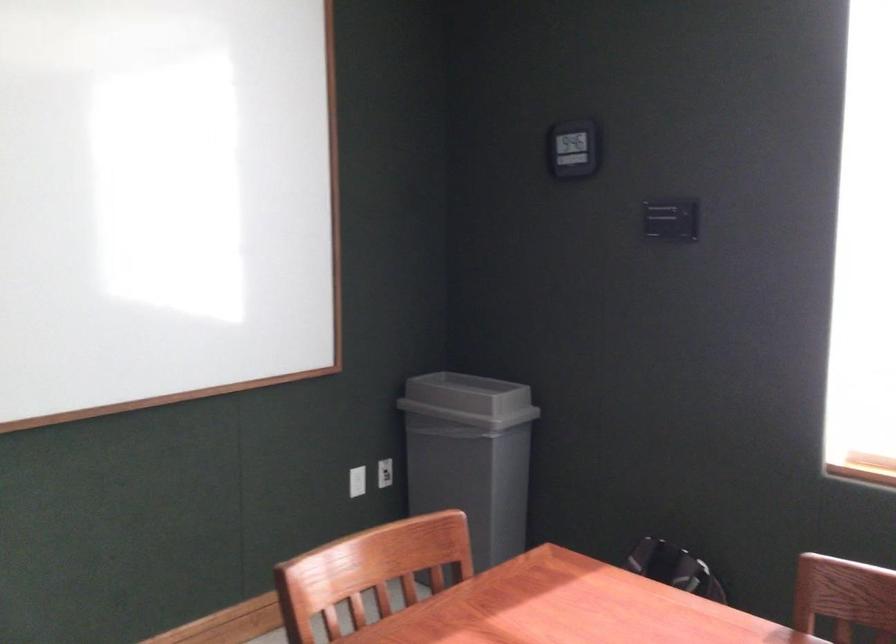
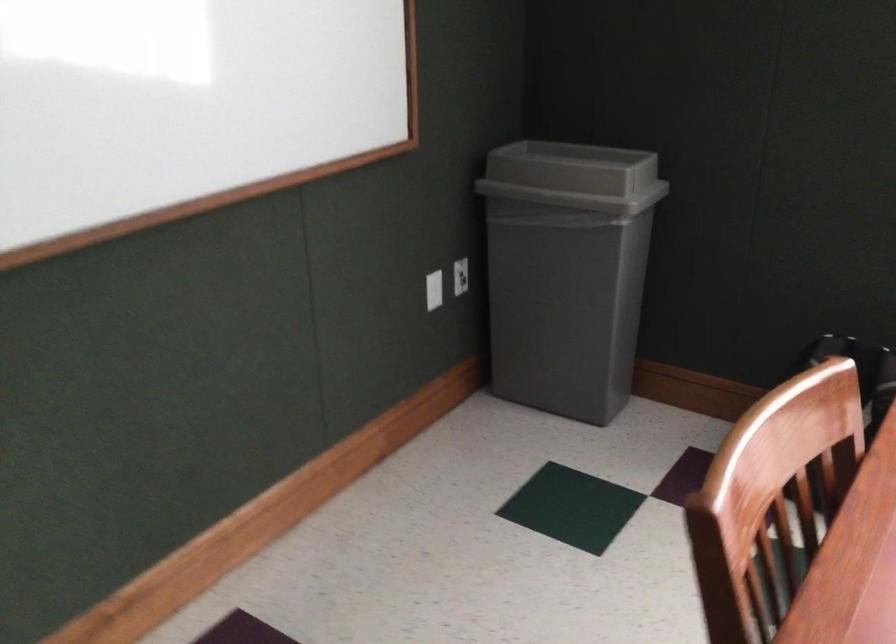
Which direction would the cameraman need to move to produce the second image?

The cameraman walked toward left, forward.